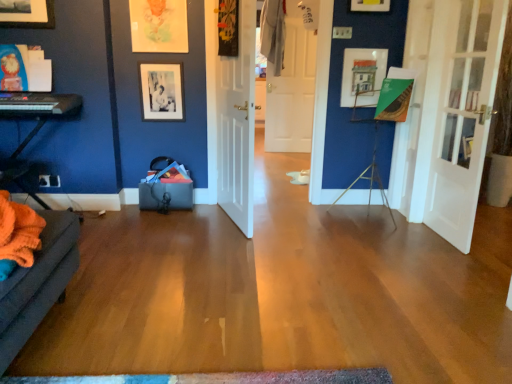
The height and width of the screenshot is (384, 512). In order to click on vacant area that is in front of white wooden door at center, the first door when ordered from left to right in this screenshot , I will do `click(208, 245)`.